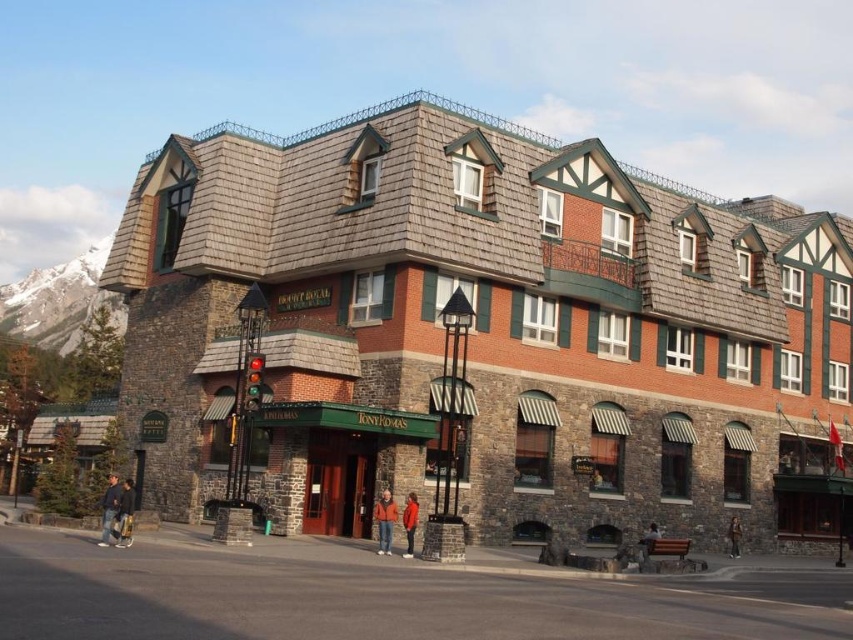
Question: Which of the following is the farthest from the observer?

Choices:
 (A) (125, 522)
 (B) (651, 525)
 (C) (412, 547)
 (D) (389, 540)

Answer: (B)

Question: Which of the following is the closest to the observer?

Choices:
 (A) orange fabric jacket at lower center
 (B) orange jacket at center
 (C) dark blue jeans at lower right

Answer: (B)

Question: Is orange fabric jacket at lower center thinner than denim jacket at lower left?

Choices:
 (A) no
 (B) yes

Answer: (B)

Question: Is denim jacket at lower left wider than dark blue jeans at lower right?

Choices:
 (A) no
 (B) yes

Answer: (A)

Question: Which object is positioned closest to the denim jacket at lower left?

Choices:
 (A) dark blue jeans at lower right
 (B) orange fabric jacket at lower center
 (C) brown stone building at center

Answer: (B)

Question: Is brown stone building at center closer to the viewer compared to denim jacket at lower left?

Choices:
 (A) yes
 (B) no

Answer: (B)